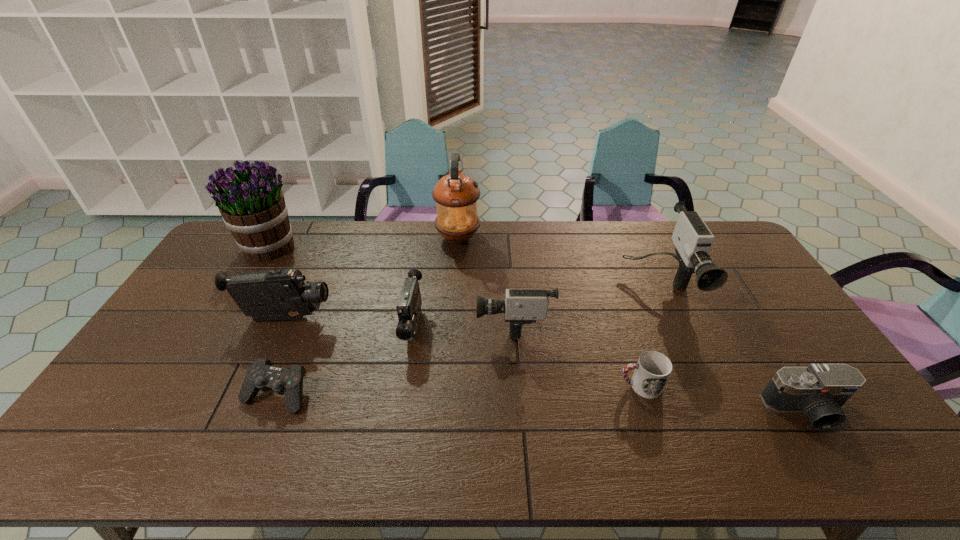
Locate an element on the screen. The width and height of the screenshot is (960, 540). vacant area that lies between the left white camcorder and the bouquet is located at coordinates (392, 285).

The height and width of the screenshot is (540, 960). In order to click on blank region between the rightmost object and the purple bouquet in this screenshot , I will do `click(538, 328)`.

I want to click on vacant space in between the oil lamp and the smaller white camcorder, so click(x=486, y=280).

Locate an element on the screen. Image resolution: width=960 pixels, height=540 pixels. free space between the cup and the sixth object from right to left is located at coordinates (526, 356).

Where is `blank region between the smaller black camcorder and the oil lamp`? The image size is (960, 540). blank region between the smaller black camcorder and the oil lamp is located at coordinates (436, 282).

You are a GUI agent. You are given a task and a screenshot of the screen. Output one action in this format:
    pyautogui.click(x=<x>, y=<y>)
    Task: Click on the vacant region between the smaller white camcorder and the control
    
    Given the screenshot: What is the action you would take?
    pyautogui.click(x=395, y=359)

Identify the location of free space between the shortest object and the left white camcorder. (395, 359).

What are the coordinates of `empty space between the purple bouquet and the fourth object from left to right` in the screenshot? It's located at (342, 286).

Where is `the closest object to the control`? the closest object to the control is located at coordinates (282, 294).

The width and height of the screenshot is (960, 540). I want to click on object that is the fourth closest one to the bouquet, so click(x=456, y=195).